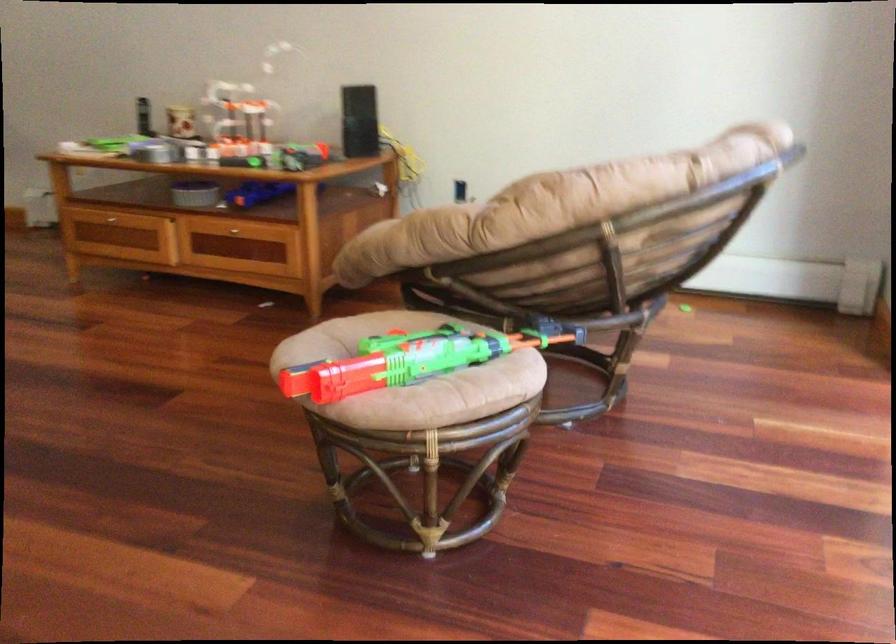
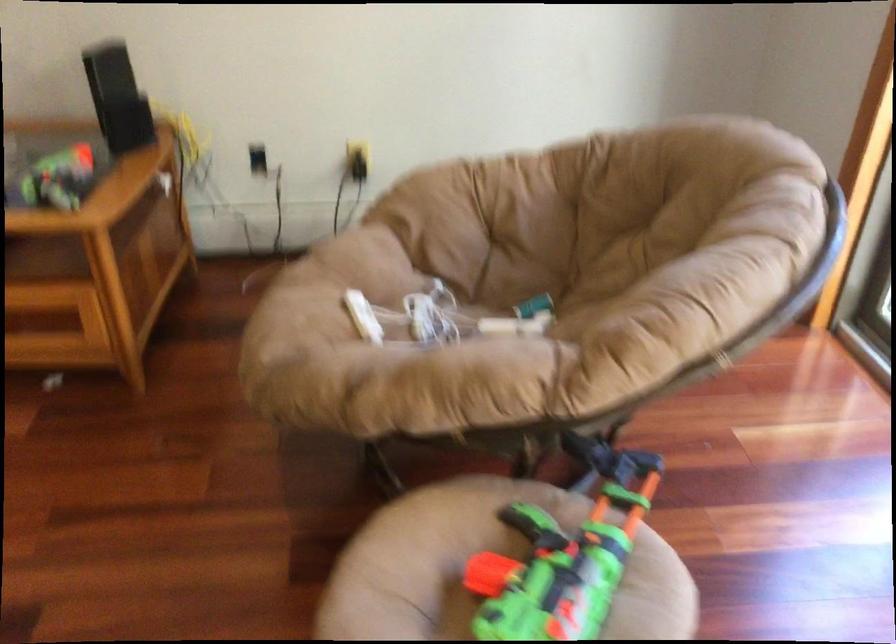
Question: I am providing you with two images of the same scene from different viewpoints. Which of the following objects are not visible in image2?

Choices:
 (A) chair sitting surface
 (B) toy gun handle
 (C) green toy gun
 (D) none of these

Answer: (D)